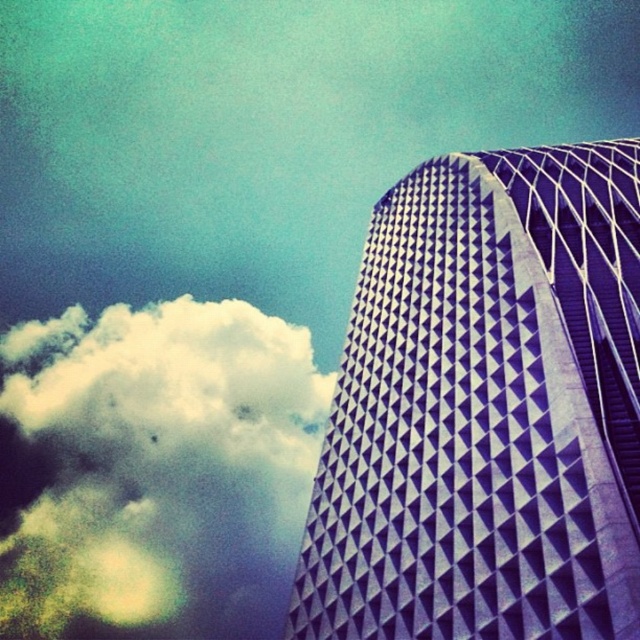
Can you confirm if purple textured building at right is taller than white fluffy cloud at upper left?

In fact, purple textured building at right may be shorter than white fluffy cloud at upper left.

The image size is (640, 640). What do you see at coordinates (484, 410) in the screenshot?
I see `purple textured building at right` at bounding box center [484, 410].

The height and width of the screenshot is (640, 640). Describe the element at coordinates (484, 410) in the screenshot. I see `purple textured building at right` at that location.

Where is `purple textured building at right`? purple textured building at right is located at coordinates (484, 410).